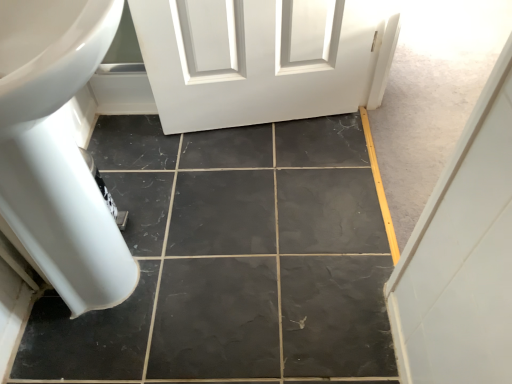
Where is `free spot behind white glossy bath at left`? This screenshot has height=384, width=512. free spot behind white glossy bath at left is located at coordinates (174, 156).